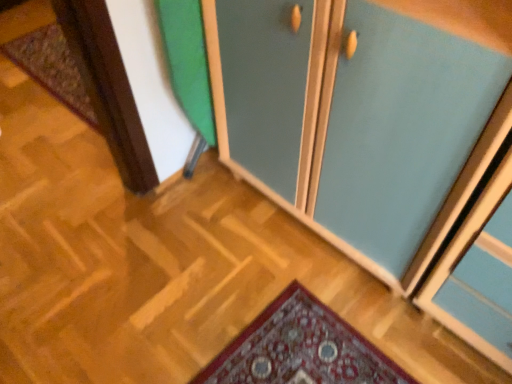
Locate an element on the screen. free location in front of teal matte cabinet at center is located at coordinates (317, 325).